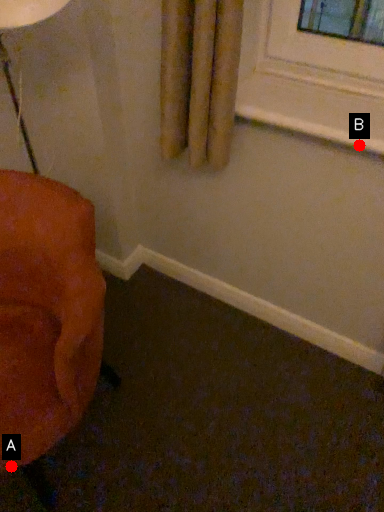
Question: Two points are circled on the image, labeled by A and B beside each circle. Which point is further to the camera?

Choices:
 (A) A is further
 (B) B is further

Answer: (B)